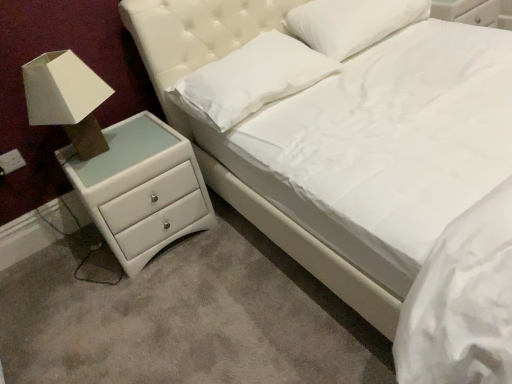
Measure the distance between white soft pillow at upper center, which appears as the first pillow when viewed from the left, and camera.

They are 5.38 feet apart.

Find the location of `white fabric lampshade at left`. white fabric lampshade at left is located at coordinates (66, 99).

Image resolution: width=512 pixels, height=384 pixels. In order to click on white soft pillow at upper center, which ranks as the second pillow in left-to-right order in this screenshot , I will do `click(352, 23)`.

This screenshot has height=384, width=512. Describe the element at coordinates (141, 189) in the screenshot. I see `white leather chest of drawers at lower left` at that location.

You are a GUI agent. You are given a task and a screenshot of the screen. Output one action in this format:
    pyautogui.click(x=<x>, y=<y>)
    Task: Click on the white soft pillow at upper center, which appears as the first pillow when viewed from the left
    Image resolution: width=512 pixels, height=384 pixels.
    Given the screenshot: What is the action you would take?
    pyautogui.click(x=250, y=79)

Which of these two, white fabric lampshade at left or white soft pillow at upper center, positioned as the 2th pillow in right-to-left order, is thinner?

white fabric lampshade at left.

Between white fabric lampshade at left and white soft pillow at upper center, positioned as the 2th pillow in right-to-left order, which one has smaller size?

white fabric lampshade at left.

Is white fabric lampshade at left positioned with its back to white soft pillow at upper center, positioned as the 2th pillow in right-to-left order?

No, white fabric lampshade at left's orientation is not away from white soft pillow at upper center, positioned as the 2th pillow in right-to-left order.

From the picture: Is white fabric lampshade at left not near white soft pillow at upper center, which appears as the first pillow when viewed from the left?

white fabric lampshade at left is near white soft pillow at upper center, which appears as the first pillow when viewed from the left, not far away.

Is white fabric lampshade at left wider or thinner than white soft pillow at upper center, which ranks as the second pillow in left-to-right order?

Clearly, white fabric lampshade at left has less width compared to white soft pillow at upper center, which ranks as the second pillow in left-to-right order.

Which object is positioned more to the right, white fabric lampshade at left or white soft pillow at upper center, which ranks as the second pillow in left-to-right order?

white soft pillow at upper center, which ranks as the second pillow in left-to-right order, is more to the right.

From the image's perspective, is white fabric lampshade at left located beneath white soft pillow at upper center, which ranks as the second pillow in left-to-right order?

Yes, from the image's perspective, white fabric lampshade at left is below white soft pillow at upper center, which ranks as the second pillow in left-to-right order.

Looking at this image, is the surface of white fabric lampshade at left in direct contact with white soft pillow at upper center, which ranks as the second pillow in left-to-right order?

No, white fabric lampshade at left is not next to white soft pillow at upper center, which ranks as the second pillow in left-to-right order.

Relative to white fabric lampshade at left, is white leather chest of drawers at lower left in front or behind?

Visually, white leather chest of drawers at lower left is located behind white fabric lampshade at left.

Is white leather chest of drawers at lower left aimed at white fabric lampshade at left?

No, white leather chest of drawers at lower left is not turned towards white fabric lampshade at left.

Is white leather chest of drawers at lower left taller than white fabric lampshade at left?

Indeed, white leather chest of drawers at lower left has a greater height compared to white fabric lampshade at left.

From a real-world perspective, is white leather chest of drawers at lower left positioned under white fabric lampshade at left based on gravity?

Yes, from a real-world perspective, white leather chest of drawers at lower left is below white fabric lampshade at left.

Does white soft pillow at upper center, positioned as the 2th pillow in right-to-left order, have a greater height compared to white soft pillow at upper center, the first pillow positioned from the right?

No.

From the image's perspective, between white soft pillow at upper center, positioned as the 2th pillow in right-to-left order, and white soft pillow at upper center, which ranks as the second pillow in left-to-right order, which one is located above?

white soft pillow at upper center, which ranks as the second pillow in left-to-right order.

Which is in front, point (239, 69) or point (340, 45)?

The point (239, 69) is more forward.

Could you tell me if white soft pillow at upper center, positioned as the 2th pillow in right-to-left order, is turned towards white soft pillow at upper center, which ranks as the second pillow in left-to-right order?

No, white soft pillow at upper center, positioned as the 2th pillow in right-to-left order, is not oriented towards white soft pillow at upper center, which ranks as the second pillow in left-to-right order.

Is white fabric lampshade at left taller than white leather chest of drawers at lower left?

No.

Is white fabric lampshade at left bigger or smaller than white leather chest of drawers at lower left?

Clearly, white fabric lampshade at left is smaller in size than white leather chest of drawers at lower left.

Which object is more forward, white fabric lampshade at left or white leather chest of drawers at lower left?

Positioned in front is white fabric lampshade at left.

Which is more to the left, white leather chest of drawers at lower left or white soft pillow at upper center, positioned as the 2th pillow in right-to-left order?

From the viewer's perspective, white leather chest of drawers at lower left appears more on the left side.

Is white leather chest of drawers at lower left facing away from white soft pillow at upper center, positioned as the 2th pillow in right-to-left order?

No, white leather chest of drawers at lower left is not facing the opposite direction of white soft pillow at upper center, positioned as the 2th pillow in right-to-left order.

Find the location of a particular element. chest of drawers on the left of white soft pillow at upper center, which appears as the first pillow when viewed from the left is located at coordinates (141, 189).

Considering the positions of point (394, 29) and point (186, 97), is point (394, 29) closer or farther from the camera than point (186, 97)?

Point (394, 29) is positioned farther from the camera compared to point (186, 97).

Looking at this image, is white soft pillow at upper center, the first pillow positioned from the right, positioned with its back to white soft pillow at upper center, which appears as the first pillow when viewed from the left?

No, white soft pillow at upper center, which appears as the first pillow when viewed from the left, is not at the back of white soft pillow at upper center, the first pillow positioned from the right.

From the image's perspective, which is above, white soft pillow at upper center, which ranks as the second pillow in left-to-right order, or white soft pillow at upper center, which appears as the first pillow when viewed from the left?

white soft pillow at upper center, which ranks as the second pillow in left-to-right order, appears higher in the image.

Locate an element on the screen. The width and height of the screenshot is (512, 384). pillow in front of the white soft pillow at upper center, which ranks as the second pillow in left-to-right order is located at coordinates (250, 79).

Starting from the white fabric lampshade at left, which pillow is the 1st one behind? Please provide its 2D coordinates.

[(250, 79)]

Image resolution: width=512 pixels, height=384 pixels. Identify the location of pillow that is the 2nd object to the right of the white fabric lampshade at left, starting at the anchor. (352, 23).

Estimate the real-world distances between objects in this image. Which object is further from white soft pillow at upper center, which appears as the first pillow when viewed from the left, white leather chest of drawers at lower left or white soft pillow at upper center, which ranks as the second pillow in left-to-right order?

white leather chest of drawers at lower left is further to white soft pillow at upper center, which appears as the first pillow when viewed from the left.

Estimate the real-world distances between objects in this image. Which object is closer to white soft pillow at upper center, which appears as the first pillow when viewed from the left, white fabric lampshade at left or white leather chest of drawers at lower left?

white leather chest of drawers at lower left is positioned closer to the anchor white soft pillow at upper center, which appears as the first pillow when viewed from the left.

Looking at the image, which one is located closer to white soft pillow at upper center, positioned as the 2th pillow in right-to-left order, white leather chest of drawers at lower left or white fabric lampshade at left?

Based on the image, white leather chest of drawers at lower left appears to be nearer to white soft pillow at upper center, positioned as the 2th pillow in right-to-left order.

Considering their positions, is white soft pillow at upper center, positioned as the 2th pillow in right-to-left order, positioned further to white leather chest of drawers at lower left than white soft pillow at upper center, the first pillow positioned from the right?

white soft pillow at upper center, the first pillow positioned from the right, is further to white leather chest of drawers at lower left.

When comparing their distances from white fabric lampshade at left, does white soft pillow at upper center, the first pillow positioned from the right, or white soft pillow at upper center, positioned as the 2th pillow in right-to-left order, seem further?

white soft pillow at upper center, the first pillow positioned from the right, is further to white fabric lampshade at left.

From the image, which object appears to be farther from white fabric lampshade at left, white soft pillow at upper center, which appears as the first pillow when viewed from the left, or white leather chest of drawers at lower left?

white soft pillow at upper center, which appears as the first pillow when viewed from the left, is positioned further to the anchor white fabric lampshade at left.

Which object lies nearer to the anchor point white soft pillow at upper center, the first pillow positioned from the right, white soft pillow at upper center, which appears as the first pillow when viewed from the left, or white leather chest of drawers at lower left?

Among the two, white soft pillow at upper center, which appears as the first pillow when viewed from the left, is located nearer to white soft pillow at upper center, the first pillow positioned from the right.

Estimate the real-world distances between objects in this image. Which object is closer to white soft pillow at upper center, which ranks as the second pillow in left-to-right order, white fabric lampshade at left or white leather chest of drawers at lower left?

Based on the image, white leather chest of drawers at lower left appears to be nearer to white soft pillow at upper center, which ranks as the second pillow in left-to-right order.

Locate an element on the screen. the chest of drawers located between white fabric lampshade at left and white soft pillow at upper center, which appears as the first pillow when viewed from the left, in the left-right direction is located at coordinates (141, 189).

The image size is (512, 384). I want to click on pillow between white leather chest of drawers at lower left and white soft pillow at upper center, which ranks as the second pillow in left-to-right order, in the horizontal direction, so click(250, 79).

Where is `chest of drawers between white fabric lampshade at left and white soft pillow at upper center, which ranks as the second pillow in left-to-right order, from left to right`? The width and height of the screenshot is (512, 384). chest of drawers between white fabric lampshade at left and white soft pillow at upper center, which ranks as the second pillow in left-to-right order, from left to right is located at coordinates (141, 189).

Image resolution: width=512 pixels, height=384 pixels. Find the location of `pillow located between white fabric lampshade at left and white soft pillow at upper center, the first pillow positioned from the right, in the left-right direction`. pillow located between white fabric lampshade at left and white soft pillow at upper center, the first pillow positioned from the right, in the left-right direction is located at coordinates (250, 79).